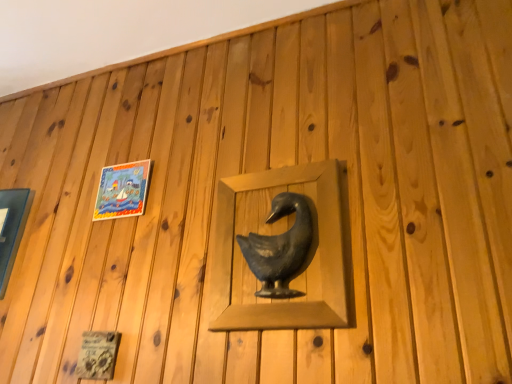
Question: From the image's perspective, is matte black duck at center over matte plastic picture frame at upper left, placed as the 1th picture frame when sorted from right to left?

Choices:
 (A) yes
 (B) no

Answer: (B)

Question: Is matte plastic picture frame at upper left, placed as the 1th picture frame when sorted from right to left, at the back of matte black duck at center?

Choices:
 (A) yes
 (B) no

Answer: (B)

Question: Is matte black duck at center not inside matte plastic picture frame at upper left, placed as the 1th picture frame when sorted from right to left?

Choices:
 (A) no
 (B) yes

Answer: (B)

Question: Is matte black duck at center far away from matte plastic picture frame at upper left, the 2th picture frame when ordered from left to right?

Choices:
 (A) yes
 (B) no

Answer: (B)

Question: Considering the relative positions of matte black duck at center and matte plastic picture frame at upper left, placed as the 1th picture frame when sorted from right to left, in the image provided, is matte black duck at center to the left of matte plastic picture frame at upper left, placed as the 1th picture frame when sorted from right to left, from the viewer's perspective?

Choices:
 (A) yes
 (B) no

Answer: (B)

Question: From a real-world perspective, is matte black duck at center beneath matte plastic picture frame at upper left, the 2th picture frame when ordered from left to right?

Choices:
 (A) no
 (B) yes

Answer: (B)

Question: From the image's perspective, is matte glass picture frame at left, which is counted as the 2th picture frame, starting from the right, over matte black duck at center?

Choices:
 (A) no
 (B) yes

Answer: (A)

Question: Could you tell me if matte glass picture frame at left, which is counted as the 2th picture frame, starting from the right, is turned towards matte black duck at center?

Choices:
 (A) yes
 (B) no

Answer: (B)

Question: Is matte glass picture frame at left, marked as the first picture frame in a left-to-right arrangement, located outside matte black duck at center?

Choices:
 (A) yes
 (B) no

Answer: (A)

Question: Considering the relative sizes of matte glass picture frame at left, which is counted as the 2th picture frame, starting from the right, and matte black duck at center in the image provided, is matte glass picture frame at left, which is counted as the 2th picture frame, starting from the right, thinner than matte black duck at center?

Choices:
 (A) no
 (B) yes

Answer: (A)

Question: Considering the relative sizes of matte glass picture frame at left, marked as the first picture frame in a left-to-right arrangement, and matte black duck at center in the image provided, is matte glass picture frame at left, marked as the first picture frame in a left-to-right arrangement, shorter than matte black duck at center?

Choices:
 (A) yes
 (B) no

Answer: (A)

Question: Considering the relative positions of matte glass picture frame at left, marked as the first picture frame in a left-to-right arrangement, and matte black duck at center in the image provided, is matte glass picture frame at left, marked as the first picture frame in a left-to-right arrangement, behind matte black duck at center?

Choices:
 (A) yes
 (B) no

Answer: (A)

Question: From the image's perspective, is matte glass picture frame at left, marked as the first picture frame in a left-to-right arrangement, over matte plastic picture frame at upper left, the 2th picture frame when ordered from left to right?

Choices:
 (A) yes
 (B) no

Answer: (B)